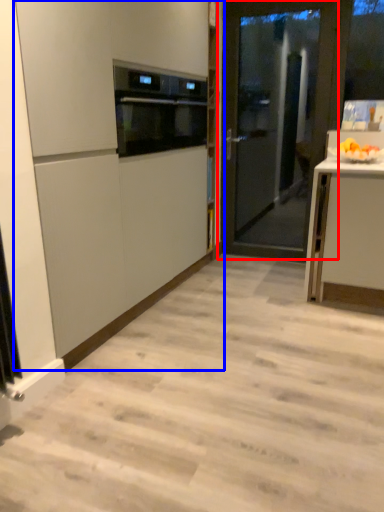
Question: Which object appears farthest to the camera in this image, door (highlighted by a red box) or cabinetry (highlighted by a blue box)?

Choices:
 (A) door
 (B) cabinetry

Answer: (A)